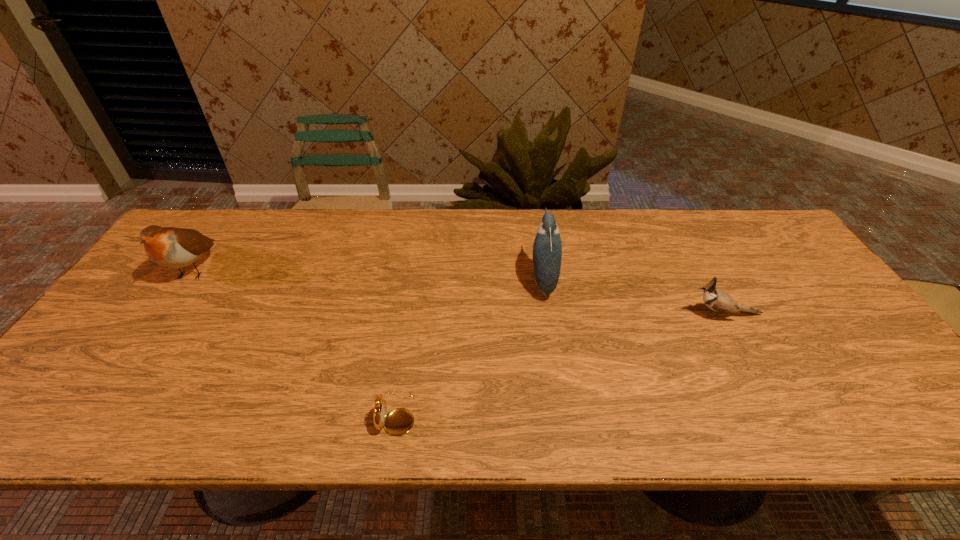
Find the location of a particular element. free space located at the face of the third tallest object is located at coordinates (621, 315).

Where is `vacant space located at the face of the third tallest object`? This screenshot has width=960, height=540. vacant space located at the face of the third tallest object is located at coordinates (613, 315).

What are the coordinates of `vacant space located 0.190m at the face of the third tallest object` in the screenshot? It's located at (613, 315).

At what (x,y) coordinates should I click in order to perform the action: click on vacant space situated on the face of the pocket watch. Please return your answer as a coordinate pair (x, y). Image resolution: width=960 pixels, height=540 pixels. Looking at the image, I should click on (513, 414).

Locate an element on the screen. This screenshot has height=540, width=960. object located at the far edge is located at coordinates (172, 247).

Where is `object situated at the near edge`? The height and width of the screenshot is (540, 960). object situated at the near edge is located at coordinates (399, 421).

Locate an element on the screen. object at the left edge is located at coordinates pyautogui.click(x=172, y=247).

What are the coordinates of `object present at the far left corner` in the screenshot? It's located at (172, 247).

Identify the location of blank space at the far edge of the desktop. (493, 226).

In the image, there is a desktop. Identify the location of vacant space at the near edge. The width and height of the screenshot is (960, 540). (503, 413).